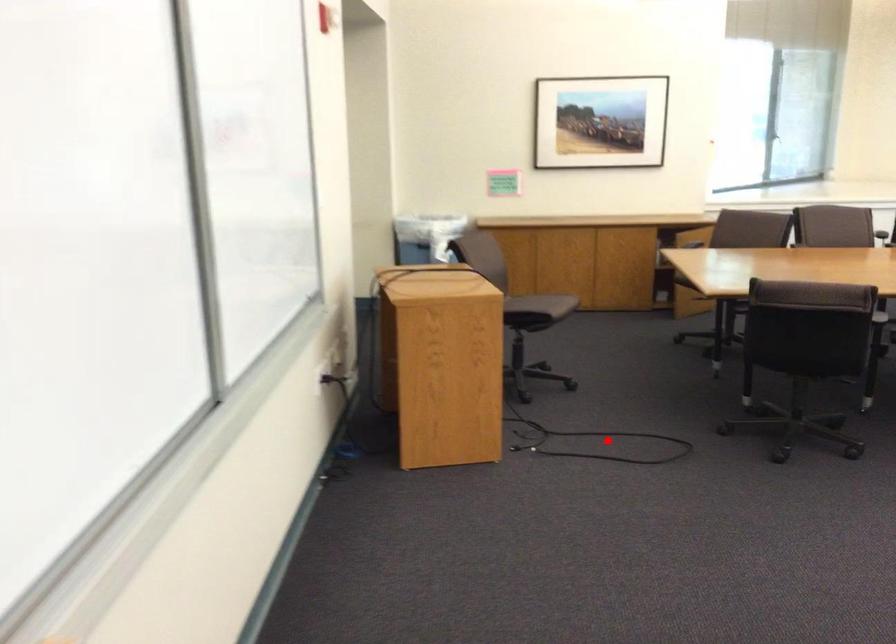
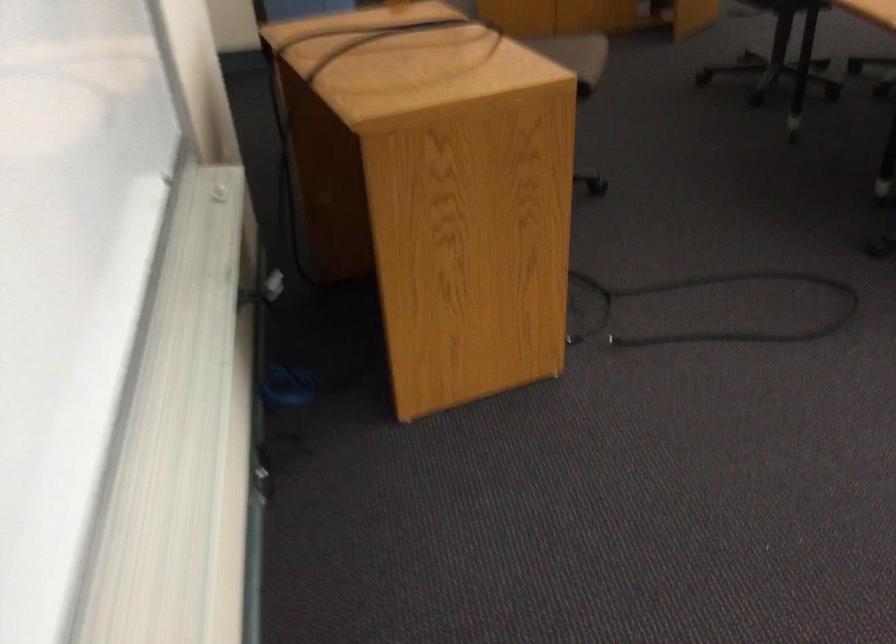
Question: I am providing you with two images of the same scene from different viewpoints. In image1, a red point is highlighted. Considering the same 3D point in image2, which of the following is correct?

Choices:
 (A) It is closer
 (B) It is farther

Answer: (A)